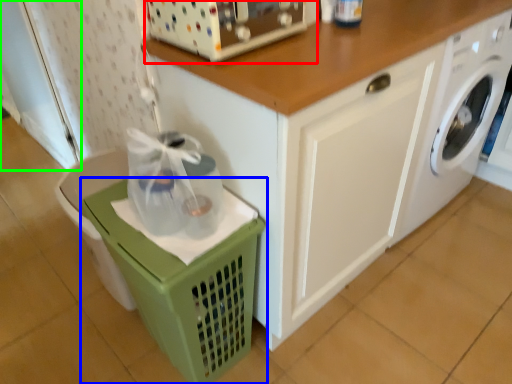
Question: Based on their relative distances, which object is nearer to appliance (highlighted by a red box)? Choose from basket (highlighted by a blue box) and screen door (highlighted by a green box).

Choices:
 (A) basket
 (B) screen door

Answer: (A)